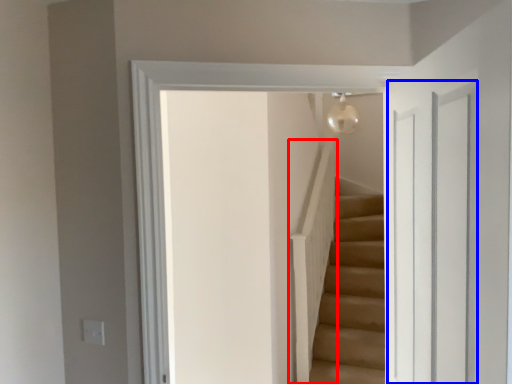
Question: Which of the following is the closest to the observer, balustrade (highlighted by a red box) or glass door (highlighted by a blue box)?

Choices:
 (A) balustrade
 (B) glass door

Answer: (B)